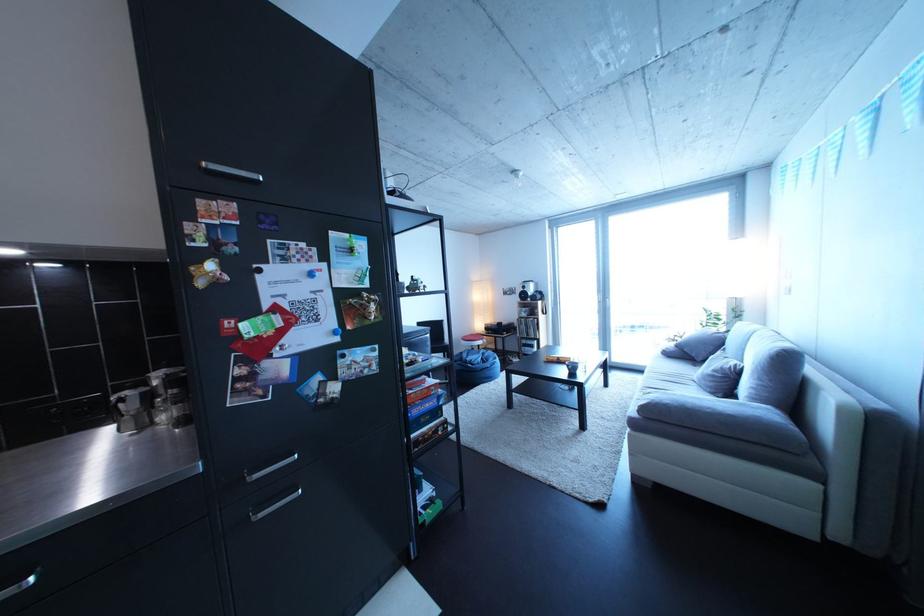
The height and width of the screenshot is (616, 924). In order to click on red board game box in this screenshot , I will do `click(419, 387)`.